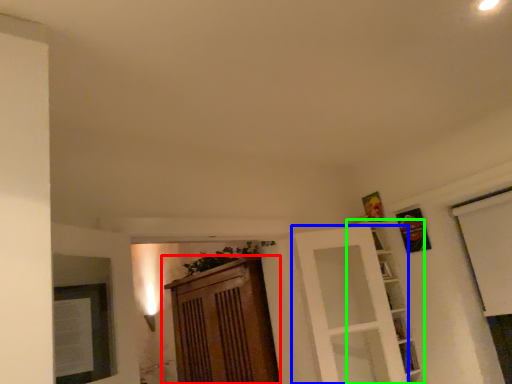
Question: Which object is the closest to the cabinetry (highlighted by a red box)? Choose among these: door (highlighted by a blue box) or shelf (highlighted by a green box).

Choices:
 (A) door
 (B) shelf

Answer: (A)